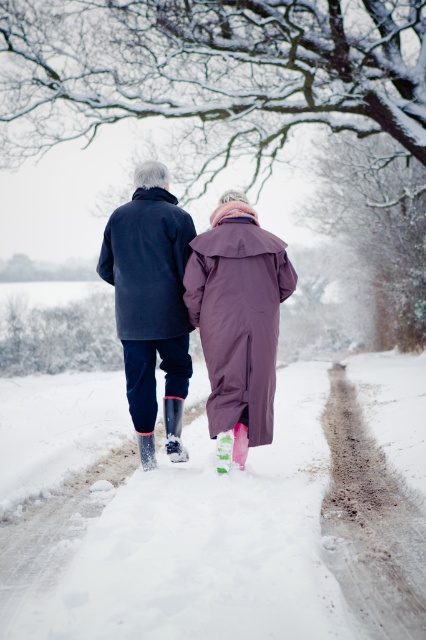
You are a photographer trying to capture the two individuals in the scene. You notice the matte black coat at center and the purple waterproof coat at center. Which coat should you focus on to ensure it appears larger in your photo?

The matte black coat at center is above the purple waterproof coat at center, so focusing on the matte black coat at center will make it appear larger in the photo due to its position closer to the camera.

You are standing at the point marked by the coordinates point [150,298]. Looking around, you see a matte black coat at center. Which direction should you walk to reach the nearest snow area?

The point [150,298] is on the matte black coat at center. To reach the nearest snow area, you should walk away from the matte black coat at center towards the snow path.

You are standing at the starting point of the snow path and want to reach the first point along the path. Which coordinate point, point (239,372) or point (183,307), is closer to you?

Point (239,372) is closer to the viewer than point (183,307), so you should head towards point (239,372) first.